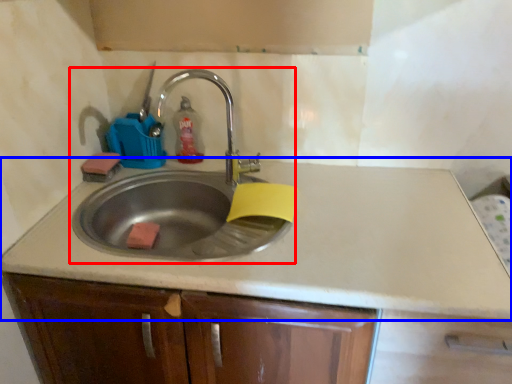
Question: Which object is closer to the camera taking this photo, sink (highlighted by a red box) or countertop (highlighted by a blue box)?

Choices:
 (A) sink
 (B) countertop

Answer: (B)